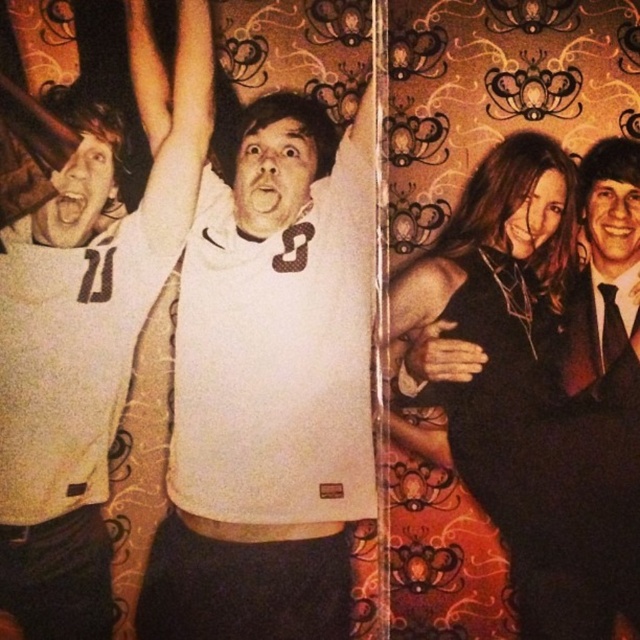
Question: Where is black satin dress at center located in relation to black satin suit at right in the image?

Choices:
 (A) above
 (B) below

Answer: (B)

Question: Based on their relative distances, which object is farther from the black satin dress at center?

Choices:
 (A) white matte jersey at center
 (B) white jersey at left

Answer: (B)

Question: Which point is closer to the camera?

Choices:
 (A) black satin suit at right
 (B) black satin dress at center
 (C) white matte jersey at center
 (D) white jersey at left

Answer: (D)

Question: In this image, where is white jersey at left located relative to black satin suit at right?

Choices:
 (A) below
 (B) above

Answer: (A)

Question: Can you confirm if black satin dress at center is positioned above black satin suit at right?

Choices:
 (A) yes
 (B) no

Answer: (B)

Question: Which of the following is the closest to the observer?

Choices:
 (A) (458, 369)
 (B) (29, 321)

Answer: (B)